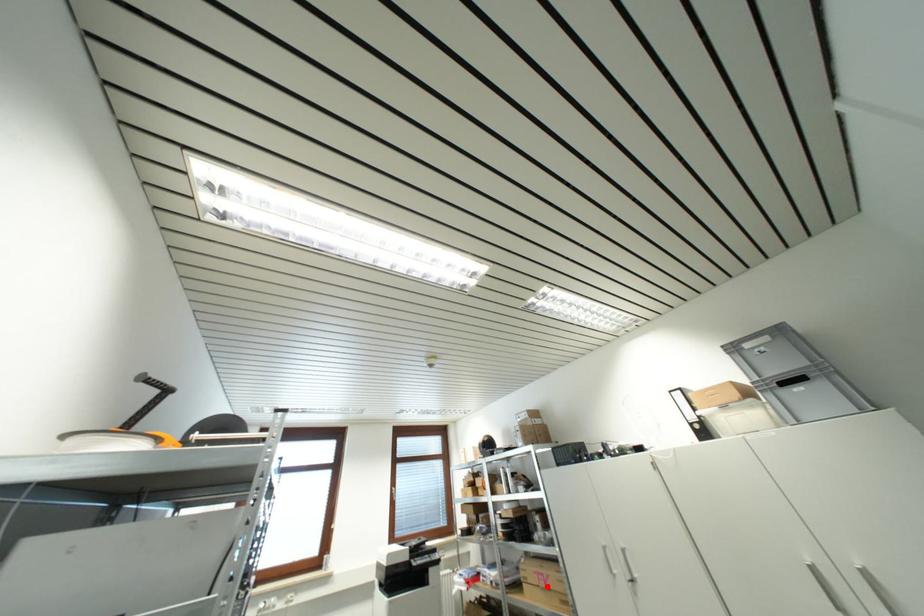
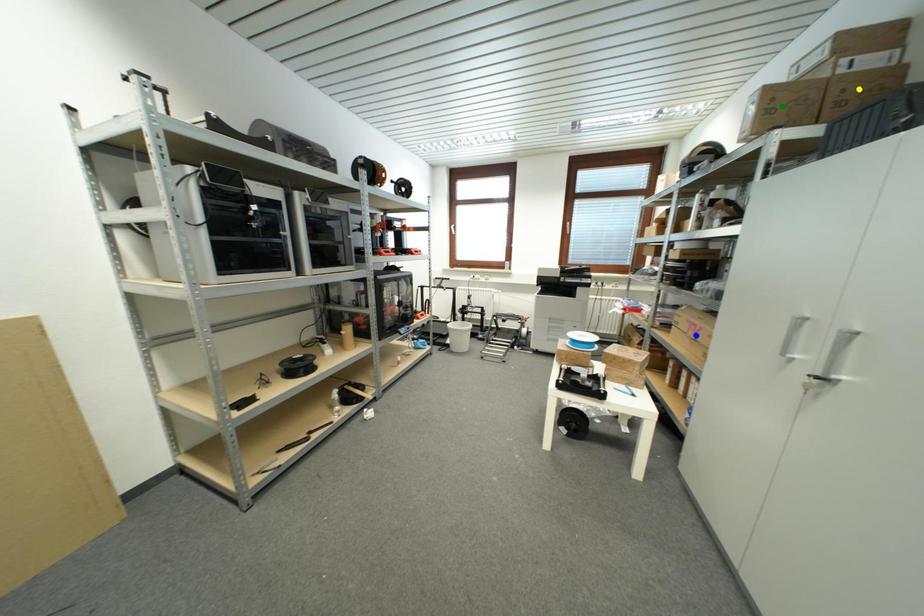
Question: I am providing you with two images of the same scene from different viewpoints. A red point is marked on the first image. You are given multiple points on the second image. Which spot in image 2 lines up with the point in image 1?

Choices:
 (A) green point
 (B) blue point
 (C) yellow point

Answer: (B)